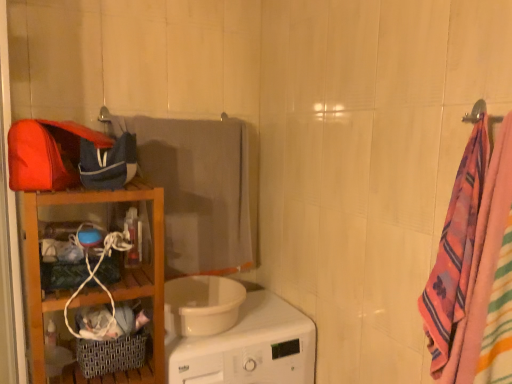
Question: From a real-world perspective, is multicolored woven towel at right, placed as the 2th beach towel when sorted from left to right, located beneath gray fabric towel at center, the second beach towel from the right?

Choices:
 (A) yes
 (B) no

Answer: (B)

Question: Is multicolored woven towel at right, the 1th beach towel from the front, to the right of gray fabric towel at center, the second beach towel from the right, from the viewer's perspective?

Choices:
 (A) yes
 (B) no

Answer: (A)

Question: Is there a large distance between multicolored woven towel at right, which is counted as the second beach towel, starting from the back, and gray fabric towel at center, acting as the first beach towel starting from the back?

Choices:
 (A) yes
 (B) no

Answer: (B)

Question: Can you confirm if multicolored woven towel at right, the 1th beach towel from the front, is wider than gray fabric towel at center, acting as the first beach towel starting from the back?

Choices:
 (A) no
 (B) yes

Answer: (A)

Question: From a real-world perspective, is multicolored woven towel at right, placed as the 2th beach towel when sorted from left to right, positioned over gray fabric towel at center, which is the 1th beach towel in left-to-right order, based on gravity?

Choices:
 (A) no
 (B) yes

Answer: (B)

Question: From their relative heights in the image, would you say wooden shelf at left is taller or shorter than gray fabric towel at center, the second beach towel from the right?

Choices:
 (A) short
 (B) tall

Answer: (B)

Question: From a real-world perspective, is wooden shelf at left positioned above or below gray fabric towel at center, the second beach towel from the front?

Choices:
 (A) below
 (B) above

Answer: (A)

Question: Based on their sizes in the image, would you say wooden shelf at left is bigger or smaller than gray fabric towel at center, the second beach towel from the front?

Choices:
 (A) small
 (B) big

Answer: (B)

Question: Looking at their shapes, would you say wooden shelf at left is wider or thinner than gray fabric towel at center, the second beach towel from the right?

Choices:
 (A) thin
 (B) wide

Answer: (B)

Question: From their relative heights in the image, would you say white glossy washing machine at center is taller or shorter than gray fabric towel at center, the second beach towel from the front?

Choices:
 (A) short
 (B) tall

Answer: (A)

Question: Looking at the image, does white glossy washing machine at center seem bigger or smaller compared to gray fabric towel at center, acting as the first beach towel starting from the back?

Choices:
 (A) small
 (B) big

Answer: (B)

Question: Which is correct: white glossy washing machine at center is inside gray fabric towel at center, which is the 1th beach towel in left-to-right order, or outside of it?

Choices:
 (A) inside
 (B) outside

Answer: (B)

Question: Looking at their shapes, would you say white glossy washing machine at center is wider or thinner than gray fabric towel at center, acting as the first beach towel starting from the back?

Choices:
 (A) wide
 (B) thin

Answer: (A)

Question: In terms of width, does gray fabric towel at center, the second beach towel from the front, look wider or thinner when compared to wooden shelf at left?

Choices:
 (A) thin
 (B) wide

Answer: (A)

Question: From their relative heights in the image, would you say gray fabric towel at center, acting as the first beach towel starting from the back, is taller or shorter than wooden shelf at left?

Choices:
 (A) tall
 (B) short

Answer: (B)